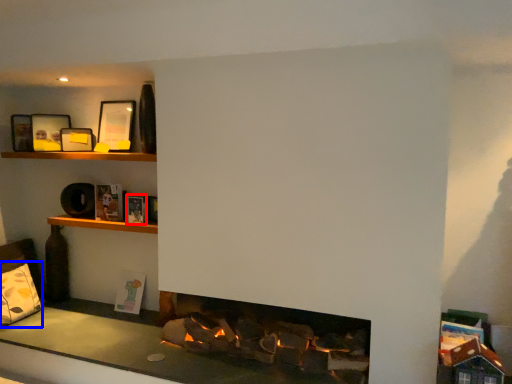
Question: Which point is further to the camera, book (highlighted by a red box) or pillow (highlighted by a blue box)?

Choices:
 (A) book
 (B) pillow

Answer: (B)